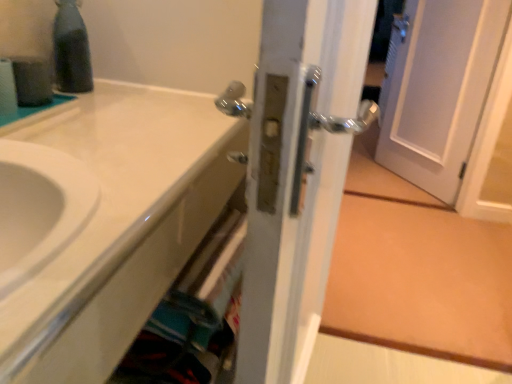
Question: Considering the positions of black glass bottle at upper left and satin nickel door handle at center in the image, is black glass bottle at upper left wider or thinner than satin nickel door handle at center?

Choices:
 (A) thin
 (B) wide

Answer: (A)

Question: From the image's perspective, relative to satin nickel door handle at center, is black glass bottle at upper left above or below?

Choices:
 (A) above
 (B) below

Answer: (A)

Question: Which is farther from the satin nickel door handle at center?

Choices:
 (A) black glass bottle at upper left
 (B) white glossy sink at lower left

Answer: (A)

Question: Which object is the closest to the white glossy sink at lower left?

Choices:
 (A) satin nickel door handle at center
 (B) black glass bottle at upper left

Answer: (A)